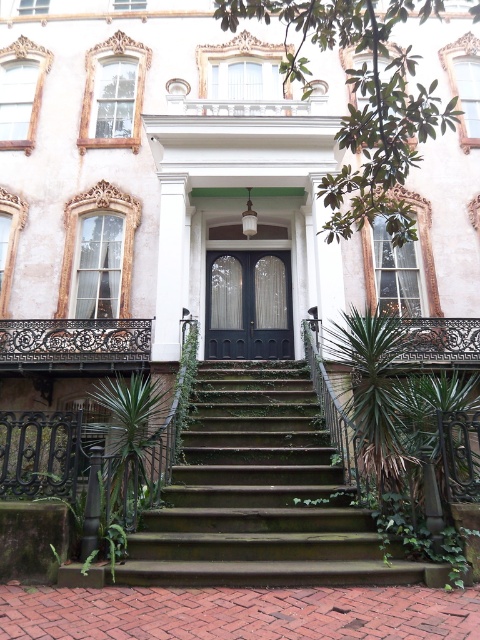
Looking at this image, you are a delivery person with a cart that is 2 meters wide. You need to navigate through the entrance of the building and pass between the green mossy stairs at center and the black wrought iron balustrade at center. Can your cart fit through the space between them?

The distance between the green mossy stairs at center and the black wrought iron balustrade at center is 4.70 meters. Since your cart is only 2 meters wide, it can easily fit through the space between them.

You are a visitor approaching the grand entrance of the historic building. You see the green mossy stairs at center and the green leafy plant at center. Which object is located directly above the other?

The green leafy plant at center is positioned above the green mossy stairs at center.

You are a visitor approaching the grand entrance of the building. You see the green mossy stairs at center and the black wrought iron balustrade at center. Which object is located below the other?

The green mossy stairs at center is positioned under the black wrought iron balustrade at center, so the stairs are below the balustrade.